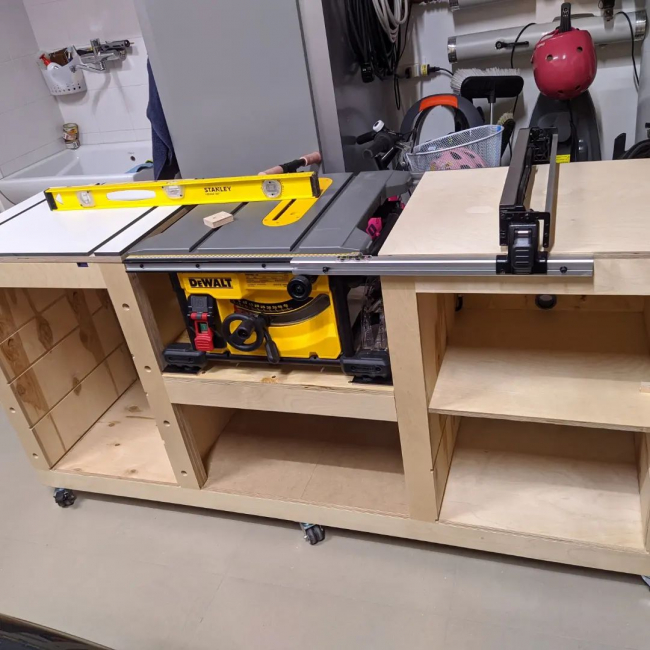
This screenshot has height=650, width=650. I want to click on sink, so click(x=99, y=159).